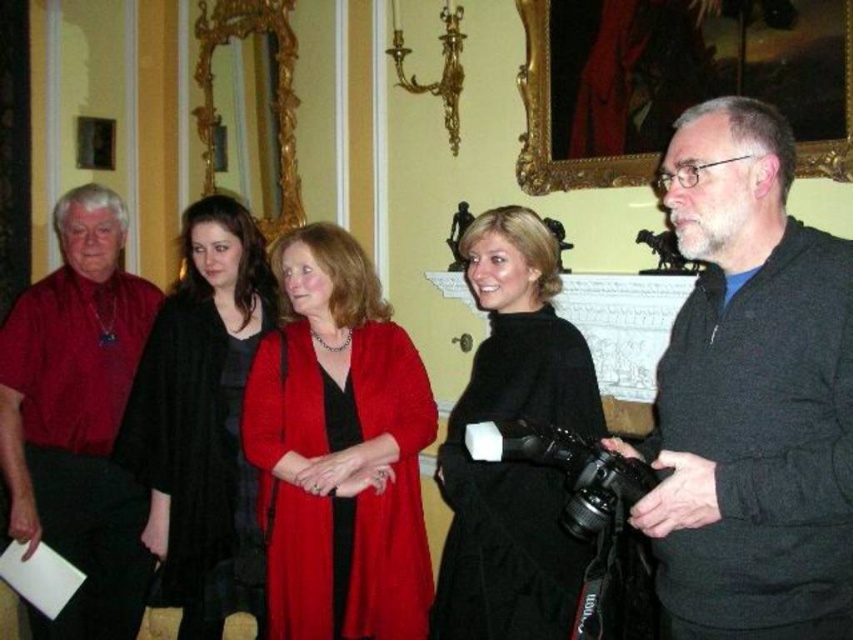
Question: Does gold-framed painting at upper center lie in front of black matte coat at center?

Choices:
 (A) yes
 (B) no

Answer: (B)

Question: Which of the following is the farthest from the observer?

Choices:
 (A) (86, 600)
 (B) (524, 396)

Answer: (A)

Question: Based on their relative distances, which object is farther from the black rubberized video camera at center?

Choices:
 (A) matte red coat at center
 (B) black matte coat at center
 (C) matte red shirt at left
 (D) dark gray sweater at right

Answer: (C)

Question: Is black woolen coat at center below black rubberized video camera at center?

Choices:
 (A) no
 (B) yes

Answer: (A)

Question: Which is nearer to the black rubberized video camera at center?

Choices:
 (A) dark gray sweater at right
 (B) matte red shirt at left
 (C) gold-framed painting at upper center
 (D) black woolen coat at center

Answer: (A)

Question: Is dark gray sweater at right thinner than matte red coat at center?

Choices:
 (A) no
 (B) yes

Answer: (B)